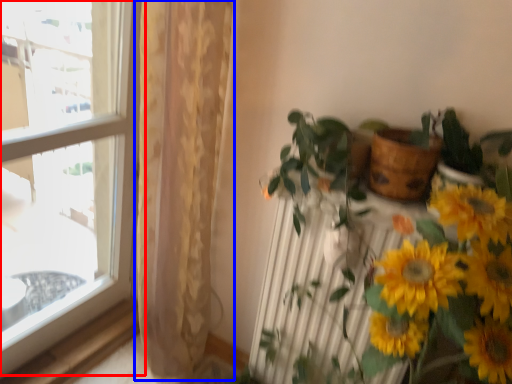
Question: Which point is further to the camera, window (highlighted by a red box) or curtain (highlighted by a blue box)?

Choices:
 (A) window
 (B) curtain

Answer: (B)